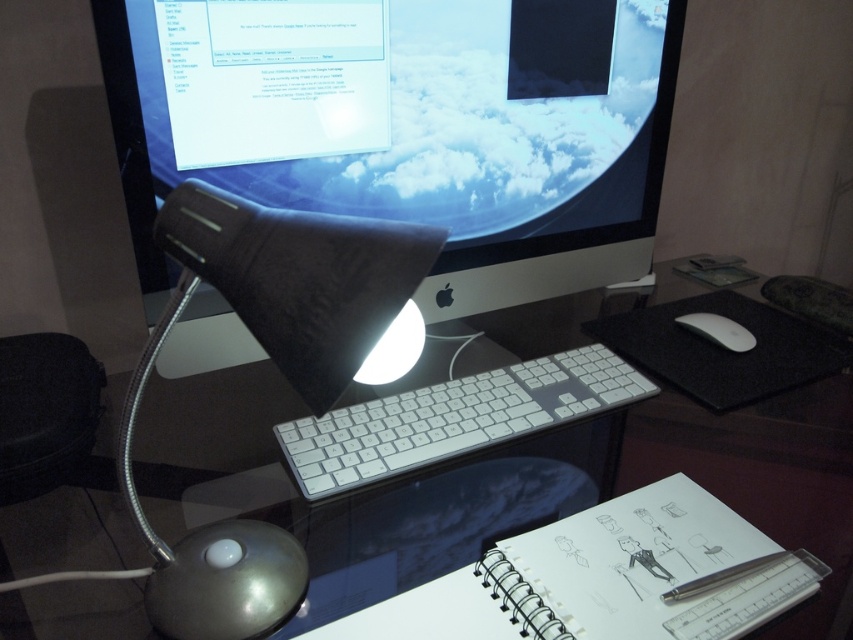
Question: Does matte black monitor at center have a lesser width compared to white matte mouse at right?

Choices:
 (A) no
 (B) yes

Answer: (A)

Question: Which object is the closest to the matte black monitor at center?

Choices:
 (A) white paper notepad at right
 (B) matte black lamp at left
 (C) metallic silver pen at lower right

Answer: (A)

Question: Does matte black monitor at center appear over white plastic keyboard at center?

Choices:
 (A) yes
 (B) no

Answer: (A)

Question: Which point appears closest to the camera in this image?

Choices:
 (A) (767, 577)
 (B) (717, 573)
 (C) (97, 632)
 (D) (595, 365)

Answer: (C)

Question: Is matte black monitor at center smaller than metallic silver pen at lower right?

Choices:
 (A) yes
 (B) no

Answer: (B)

Question: Which point appears farthest from the camera in this image?

Choices:
 (A) (271, 480)
 (B) (786, 333)
 (C) (666, 484)

Answer: (B)